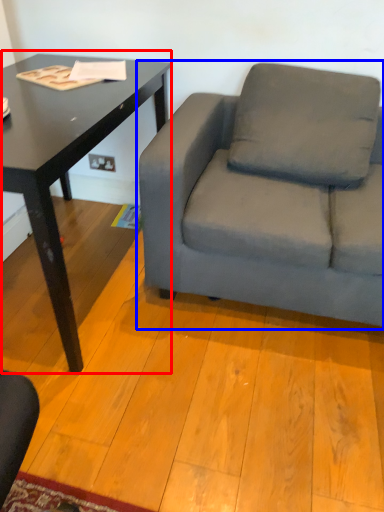
Question: Which object is closer to the camera taking this photo, table (highlighted by a red box) or studio couch (highlighted by a blue box)?

Choices:
 (A) table
 (B) studio couch

Answer: (A)